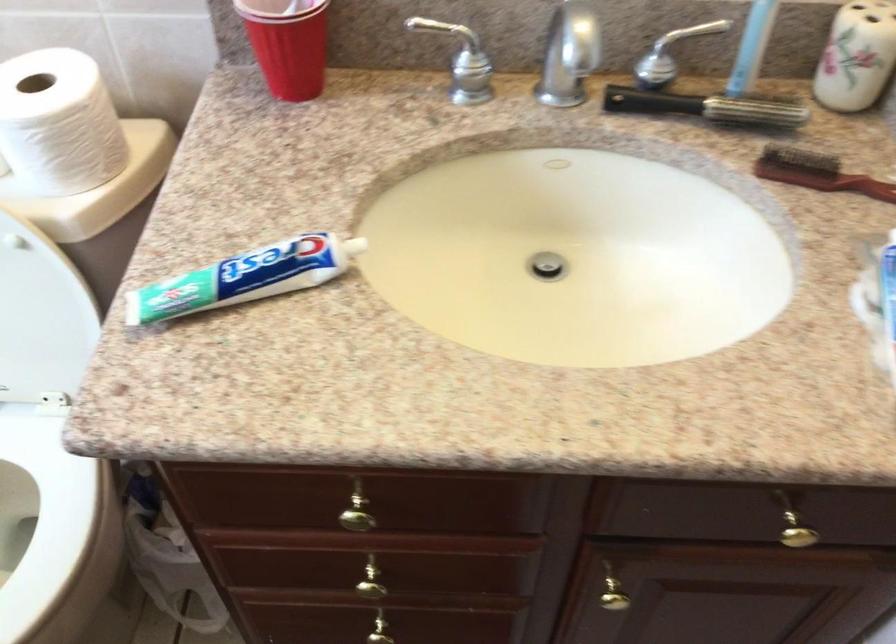
Which object does [816,173] point to?

It corresponds to the brown hairbrush in the image.